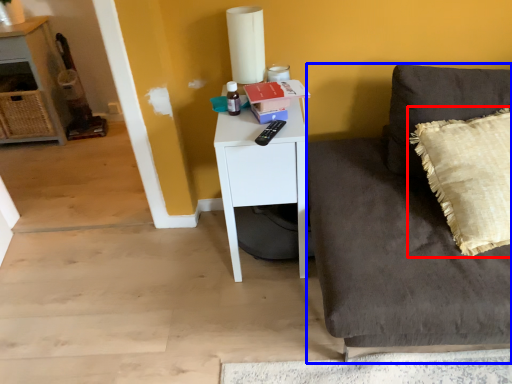
Question: Which point is further to the camera, pillow (highlighted by a red box) or studio couch (highlighted by a blue box)?

Choices:
 (A) pillow
 (B) studio couch

Answer: (A)